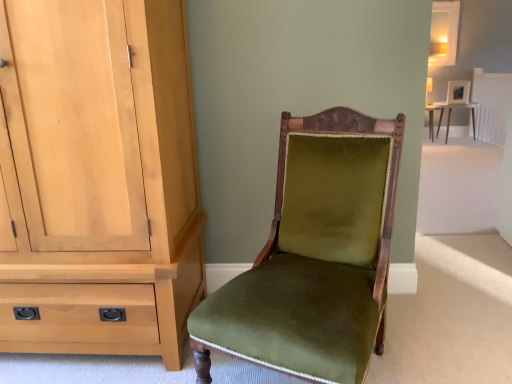
Question: Based on their sizes in the image, would you say light wood cabinet at left is bigger or smaller than velvet-green chair at center?

Choices:
 (A) small
 (B) big

Answer: (B)

Question: Is light wood cabinet at left taller or shorter than velvet-green chair at center?

Choices:
 (A) short
 (B) tall

Answer: (B)

Question: Estimate the real-world distances between objects in this image. Which object is farther from the matte white table at upper right?

Choices:
 (A) light wood cabinet at left
 (B) velvet-green chair at center

Answer: (A)

Question: Which object is the closest to the matte white table at upper right?

Choices:
 (A) velvet-green chair at center
 (B) light wood cabinet at left

Answer: (A)